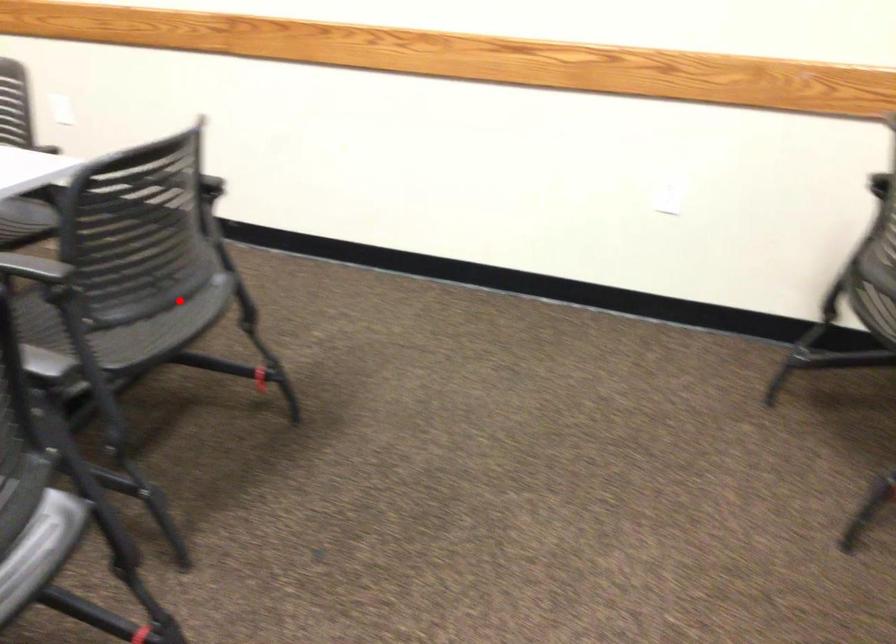
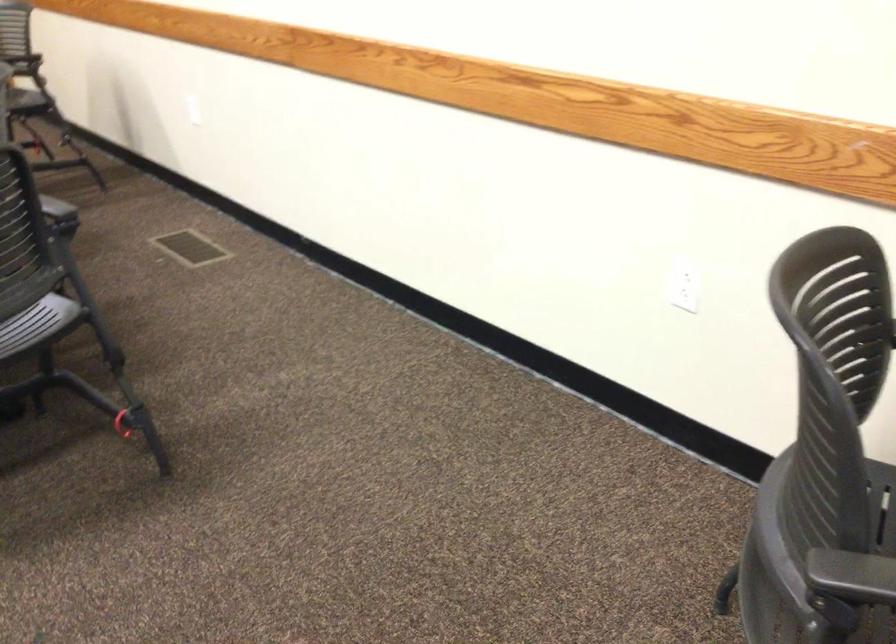
Where in the second image is the point corresponding to the highlighted location from the first image?

(37, 323)